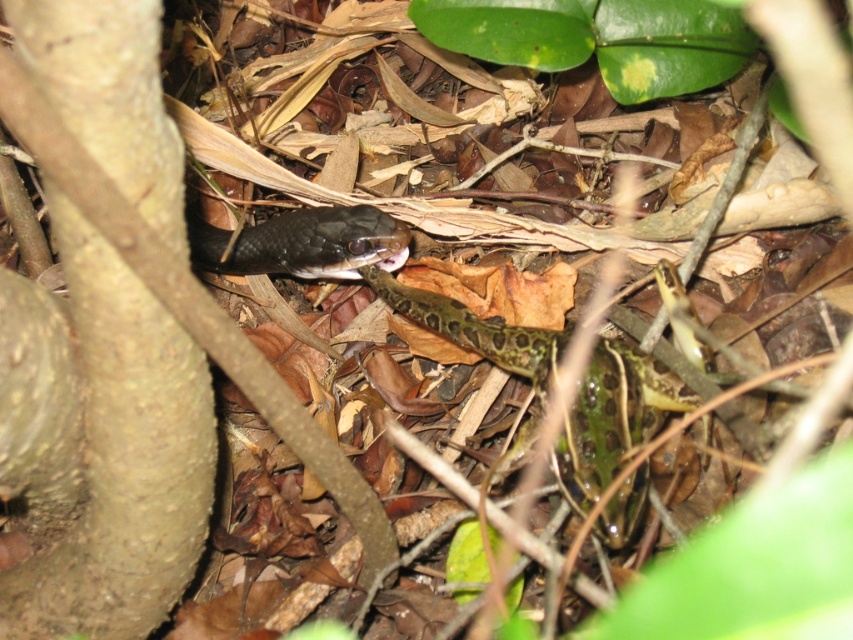
Is smooth brown tree trunk at left behind green spotted python at center?

No.

Locate an element on the screen. This screenshot has height=640, width=853. smooth brown tree trunk at left is located at coordinates (140, 340).

Between smooth brown tree trunk at left and shiny black snake at center, which one has more height?

smooth brown tree trunk at left is taller.

From the picture: Can you confirm if smooth brown tree trunk at left is wider than shiny black snake at center?

Yes, smooth brown tree trunk at left is wider than shiny black snake at center.

I want to click on smooth brown tree trunk at left, so click(x=140, y=340).

Find the location of a particular element. The image size is (853, 640). smooth brown tree trunk at left is located at coordinates (140, 340).

Based on the photo, is green spotted python at center above shiny black snake at center?

No, green spotted python at center is not above shiny black snake at center.

Locate an element on the screen. green spotted python at center is located at coordinates (610, 419).